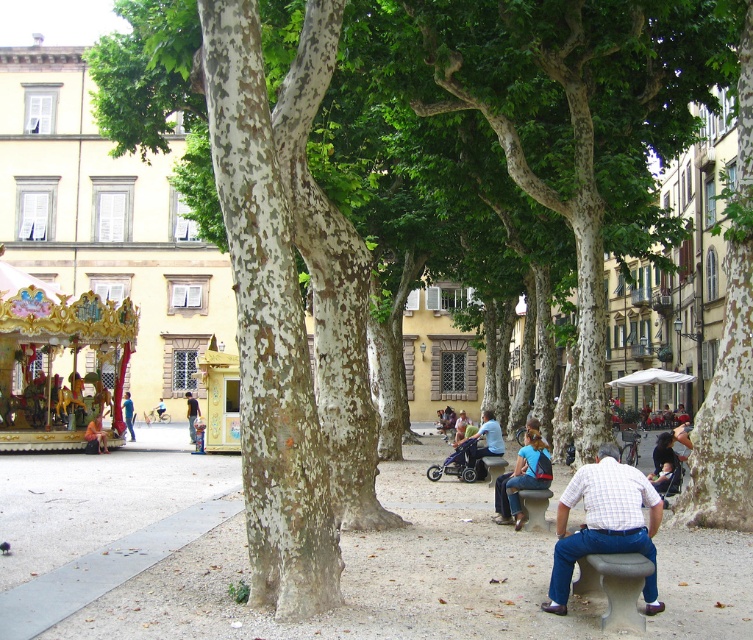
Question: Can you confirm if gray concrete bench at lower right is wider than blue denim jeans at center?

Choices:
 (A) yes
 (B) no

Answer: (B)

Question: Does dark blue jeans at lower right have a larger size compared to orange fabric bag at center?

Choices:
 (A) no
 (B) yes

Answer: (B)

Question: Which object is positioned farthest from the gold-painted wood carousel at left?

Choices:
 (A) light blue shirt at center
 (B) blue denim jeans at center
 (C) light brown leather chair at lower right

Answer: (C)

Question: Which point is closer to the camera?

Choices:
 (A) light blue shirt at center
 (B) dark blue jeans at lower right

Answer: (B)

Question: Is gold-painted wood carousel at left positioned in front of light blue jeans at center?

Choices:
 (A) yes
 (B) no

Answer: (A)

Question: Among these objects, which one is nearest to the camera?

Choices:
 (A) dark blue jeans at lower right
 (B) orange fabric bag at center

Answer: (A)